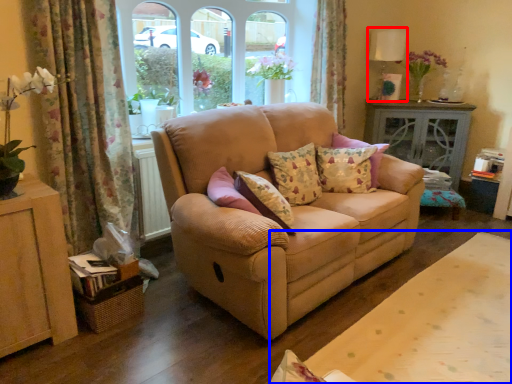
Question: Which object appears farthest to the camera in this image, lamp (highlighted by a red box) or plain (highlighted by a blue box)?

Choices:
 (A) lamp
 (B) plain

Answer: (A)